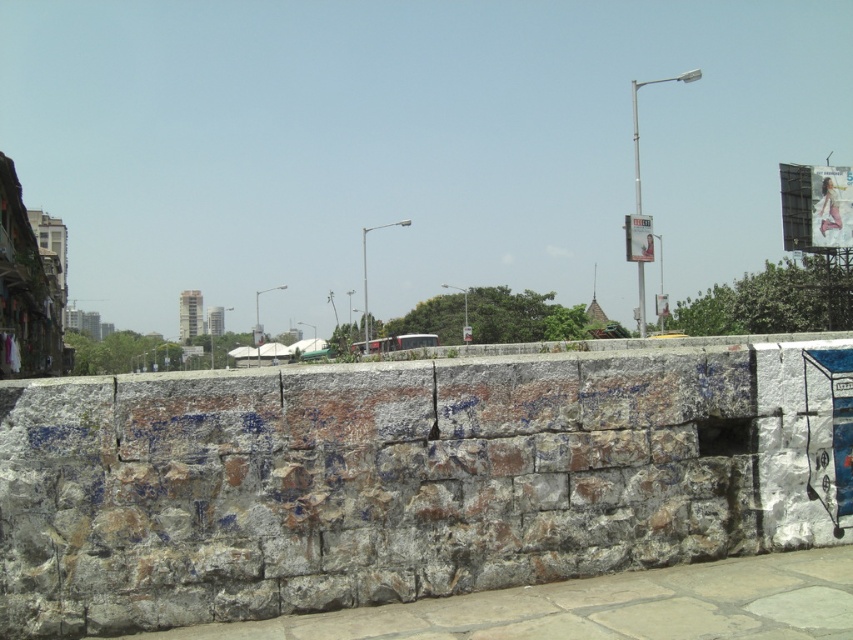
Who is lower down, rusty stone wall at center or gray stone pavement at lower left?

gray stone pavement at lower left

Which is in front, point (10, 545) or point (811, 568)?

Positioned in front is point (10, 545).

Identify the location of rusty stone wall at center. (410, 476).